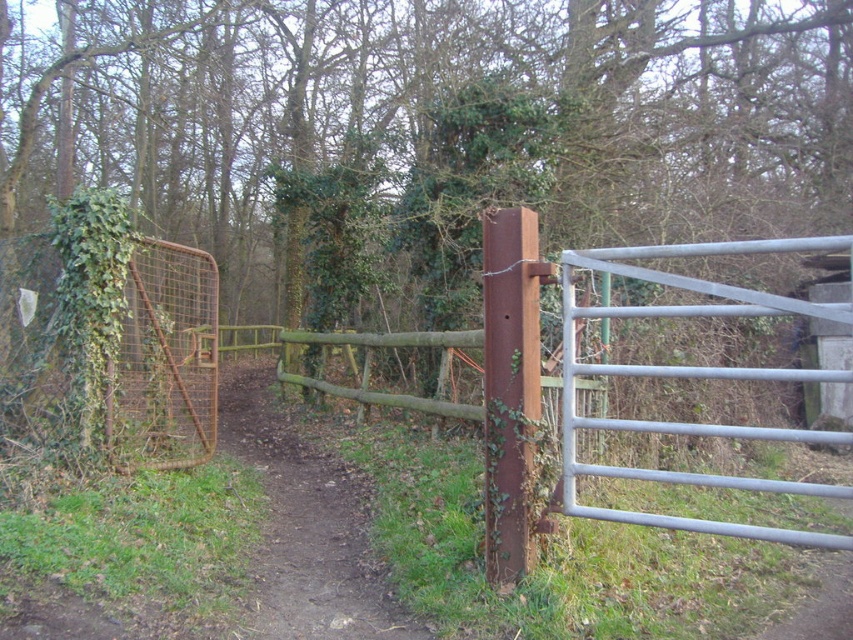
The width and height of the screenshot is (853, 640). I want to click on rusty metal gate at center, so click(x=693, y=378).

Does rusty metal gate at center have a greater height compared to brown dirt path at center?

No.

Looking at this image, who is more forward, [573,353] or [415,628]?

Positioned in front is point [415,628].

What are the coordinates of `rusty metal gate at center` in the screenshot? It's located at (693, 378).

The image size is (853, 640). Describe the element at coordinates (426, 129) in the screenshot. I see `green ivy-covered tree at center` at that location.

Which is above, green ivy-covered tree at center or rusty metal gate at center?

green ivy-covered tree at center is higher up.

I want to click on green ivy-covered tree at center, so (426, 129).

Where is `green ivy-covered tree at center`? The height and width of the screenshot is (640, 853). green ivy-covered tree at center is located at coordinates (426, 129).

Between green ivy-covered tree at center and brown dirt path at center, which one is positioned higher?

green ivy-covered tree at center

This screenshot has height=640, width=853. In order to click on green ivy-covered tree at center in this screenshot , I will do `click(426, 129)`.